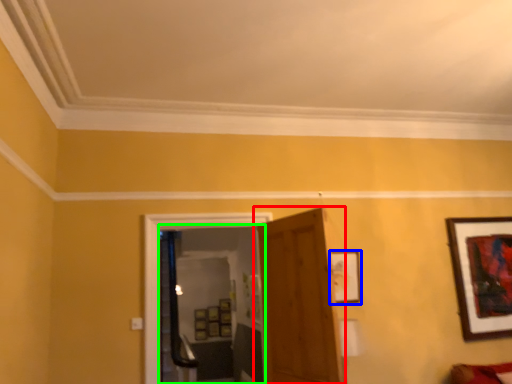
Question: Estimate the real-world distances between objects in this image. Which object is farther from door (highlighted by a red box), picture frame (highlighted by a blue box) or glass door (highlighted by a green box)?

Choices:
 (A) picture frame
 (B) glass door

Answer: (B)